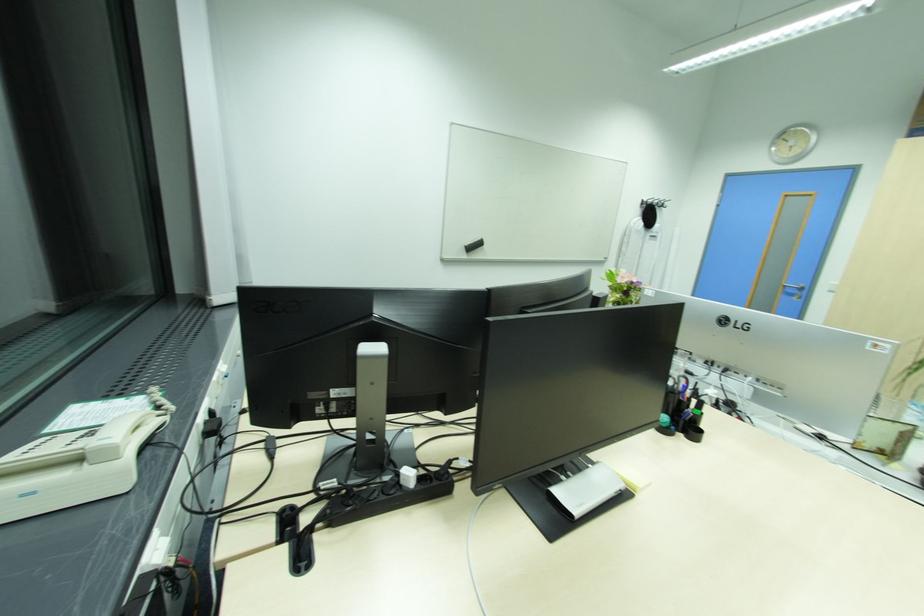
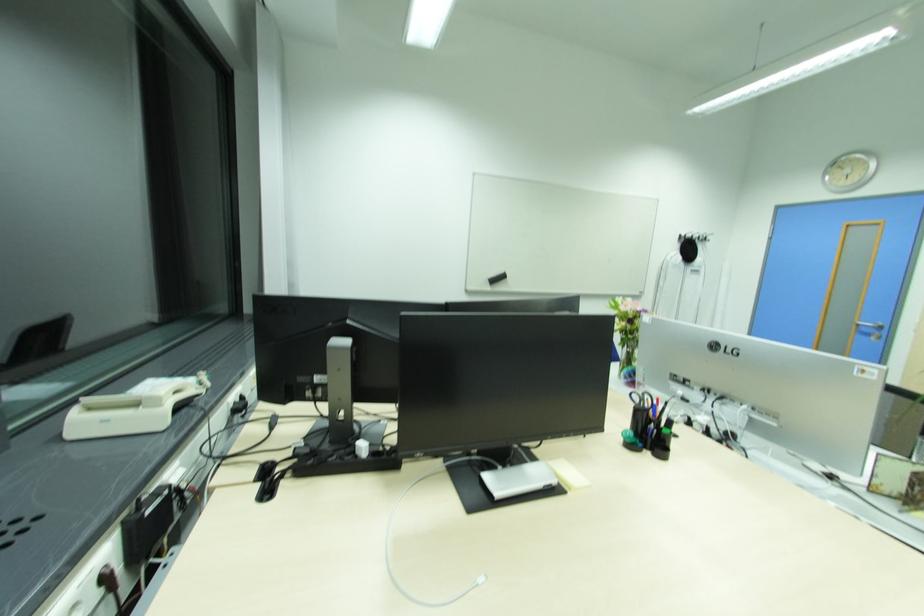
The point at (627, 487) is marked in the first image. Where is the corresponding point in the second image?

(560, 483)